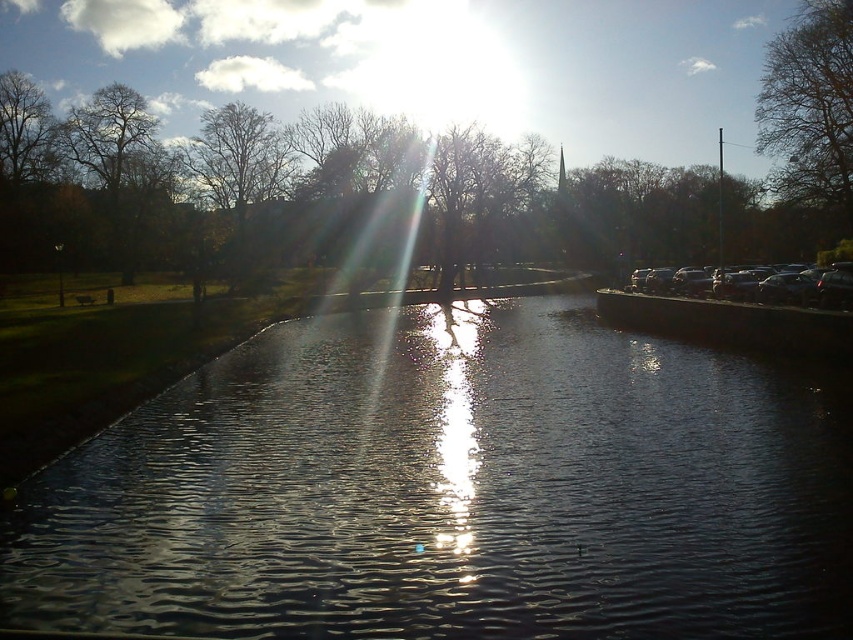
Is brown leafless tree at upper right wider than brown leafless tree at upper left?

Yes, brown leafless tree at upper right is wider than brown leafless tree at upper left.

Between brown leafless tree at upper right and brown leafless tree at upper left, which one is positioned higher?

brown leafless tree at upper right is higher up.

Locate an element on the screen. This screenshot has width=853, height=640. brown leafless tree at upper right is located at coordinates (810, 106).

You are a GUI agent. You are given a task and a screenshot of the screen. Output one action in this format:
    pyautogui.click(x=<x>, y=<y>)
    Task: Click on the brown leafless tree at upper right
    
    Given the screenshot: What is the action you would take?
    810,106

Who is positioned more to the right, shiny dark water at center or brown leafless tree at upper left?

shiny dark water at center is more to the right.

Who is more forward, (137,524) or (80,141)?

Point (137,524) is in front.

You are a GUI agent. You are given a task and a screenshot of the screen. Output one action in this format:
    pyautogui.click(x=<x>, y=<y>)
    Task: Click on the shiny dark water at center
    The width and height of the screenshot is (853, 640).
    Given the screenshot: What is the action you would take?
    (x=451, y=490)

Is shiny dark water at center below brown leafless tree at upper right?

Indeed, shiny dark water at center is positioned under brown leafless tree at upper right.

Does shiny dark water at center have a greater width compared to brown leafless tree at upper right?

Incorrect, shiny dark water at center's width does not surpass brown leafless tree at upper right's.

Measure the distance between shiny dark water at center and camera.

shiny dark water at center and camera are 22.93 feet apart from each other.

The width and height of the screenshot is (853, 640). Find the location of `shiny dark water at center`. shiny dark water at center is located at coordinates (451, 490).